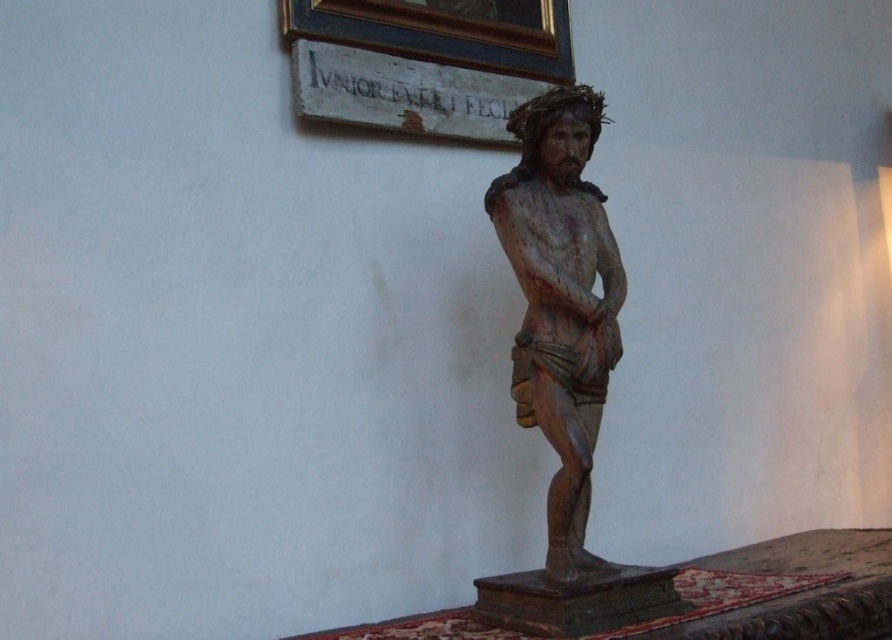
You are an art conservator examining the wooden statue at center and the wooden plaque at upper center in the image. Based on their positions, which object is located higher up?

The wooden plaque at upper center is higher up than the wooden statue at center.

Consider the image. You are an art conservator examining the wooden sculpture of Jesus Christ. You notice two points on the sculpture at coordinates point (523, 268) and point (517, 44). Based on your observation, which point is nearer to your viewpoint as you face the sculpture?

Point (523, 268) is closer to the camera than point (517, 44), so the point at (523, 268) is nearer to your viewpoint.

You are a photographer standing 5 feet away from the wooden statue at center. You want to take a closeup photo of it without moving closer. Is the statue within your current shooting range?

The wooden statue at center is 4.85 feet away from the camera, which is within the photographer standing 5 feet away. Therefore, the statue is within the shooting range and can be captured in the photo without moving closer.